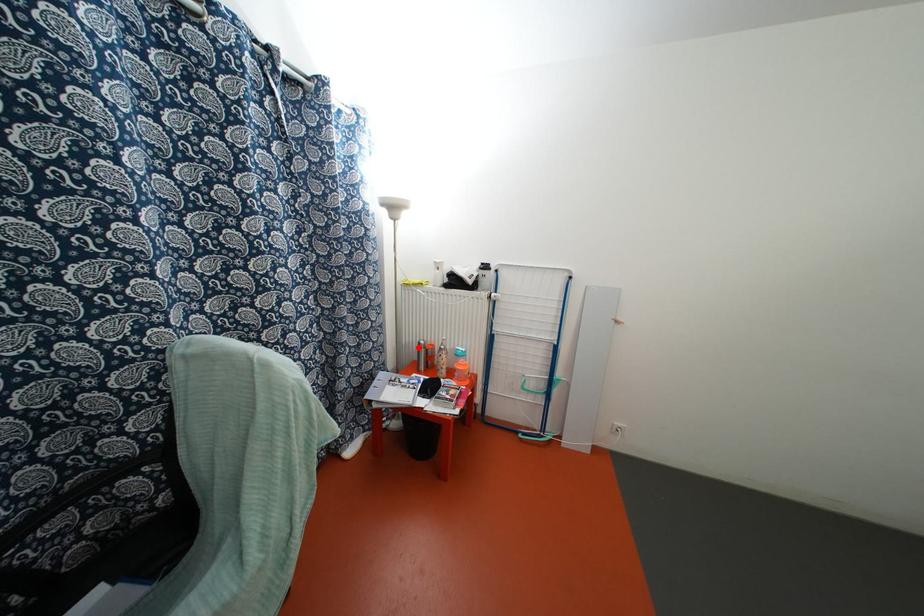
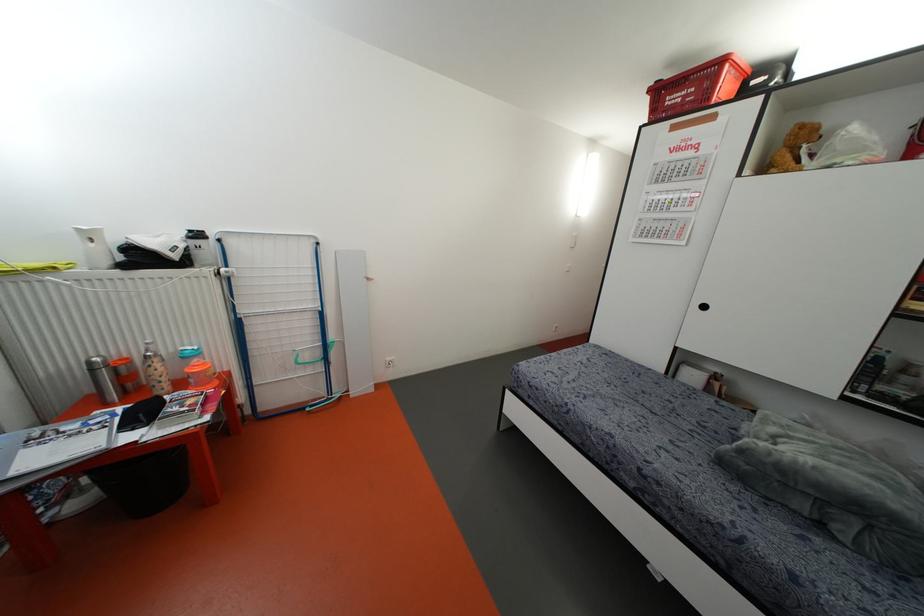
In the second image, find the point that corresponds to the highlighted location in the first image.

(91, 370)